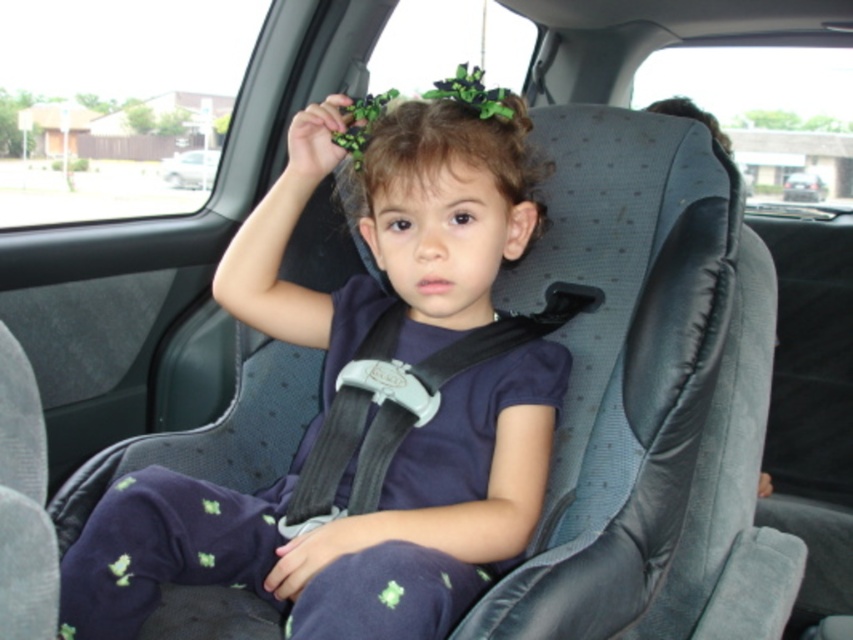
You are a safety inspector checking the car seat installation. You notice the matte black car seat at center and the black fabric seatbelt at center. According to safety guidelines, the car seat must be placed in a position where it does not interfere with the seatbelt. Does the current placement comply with this requirement?

The matte black car seat at center is positioned over the black fabric seatbelt at center, which means it is interfering with the seatbelt. This placement does not comply with safety guidelines as the car seat should not block or overlap the seatbelt.

Consider the image. You are a safety inspector checking the car seat installation. The car seat must be installed so that its height is at least twice the height of the child. Based on the scene, can you confirm if the matte black car seat at center meets this requirement compared to the dark brown hair at center?

The matte black car seat at center is much taller than the dark brown hair at center, so it meets the requirement of being at least twice the height of the child.

You are a safety inspector checking the car seat installation. According to the image, is the matte black car seat at center properly positioned relative to the black fabric seatbelt at center?

The matte black car seat at center is positioned on the left side of the black fabric seatbelt at center, which is correct as the car seat should be placed on the side opposite the seatbelt to ensure proper alignment and safety.